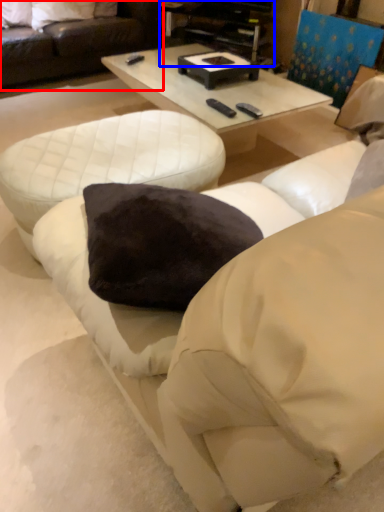
Question: Which of the following is the closest to the observer, studio couch (highlighted by a red box) or entertainment center (highlighted by a blue box)?

Choices:
 (A) studio couch
 (B) entertainment center

Answer: (A)